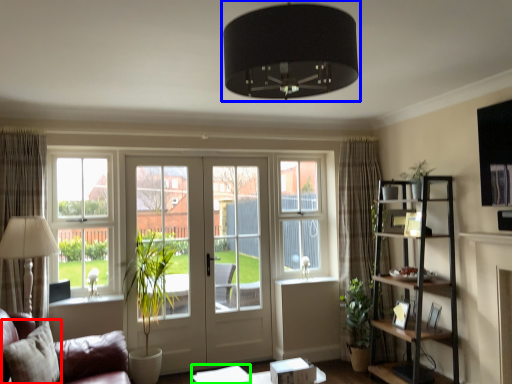
Question: Estimate the real-world distances between objects in this image. Which object is closer to pillow (highlighted by a red box), lamp (highlighted by a blue box) or table (highlighted by a green box)?

Choices:
 (A) lamp
 (B) table

Answer: (B)